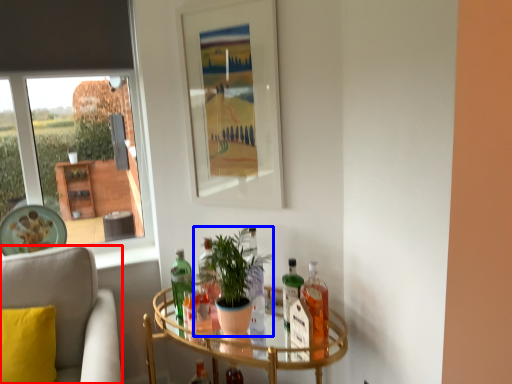
Question: Which object appears farthest to the camera in this image, chair (highlighted by a red box) or houseplant (highlighted by a blue box)?

Choices:
 (A) chair
 (B) houseplant

Answer: (B)